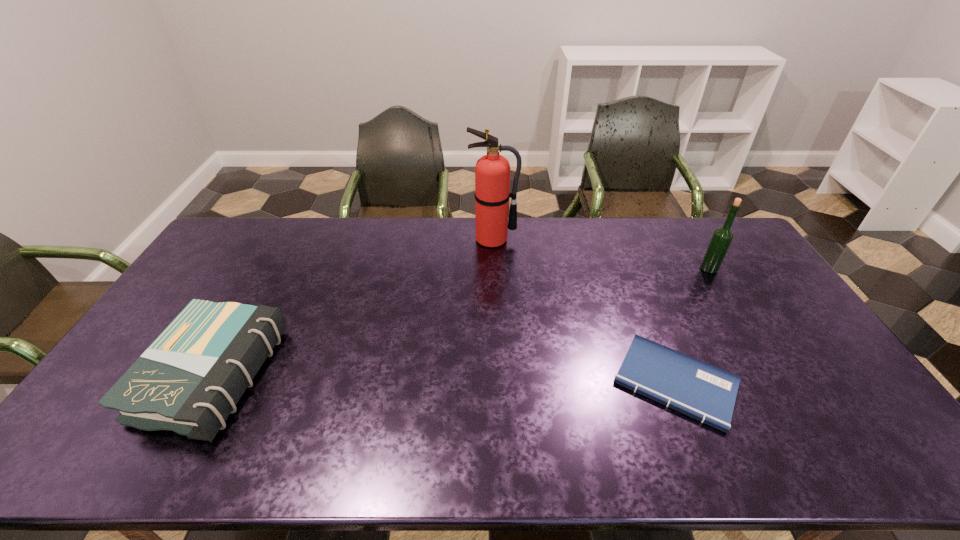
Locate an element on the screen. The width and height of the screenshot is (960, 540). the tallest object is located at coordinates (492, 171).

Identify the location of the farthest object. This screenshot has width=960, height=540. (492, 171).

Image resolution: width=960 pixels, height=540 pixels. Identify the location of the second farthest object. (722, 237).

Identify the location of the rightmost object. (722, 237).

At what (x,y) coordinates should I click in order to perform the action: click on the taller paperback book. Please return your answer as a coordinate pair (x, y). Looking at the image, I should click on [x=189, y=380].

I want to click on the leftmost object, so click(x=189, y=380).

This screenshot has width=960, height=540. Identify the location of the shortest object. (707, 393).

The height and width of the screenshot is (540, 960). I want to click on the shorter paperback book, so click(x=707, y=393).

Where is `free spot located 0.390m at the nozzle of the tallest object`? free spot located 0.390m at the nozzle of the tallest object is located at coordinates (496, 328).

Find the location of a particular element. The height and width of the screenshot is (540, 960). vacant region located 0.240m on the back of the third nearest object is located at coordinates (683, 225).